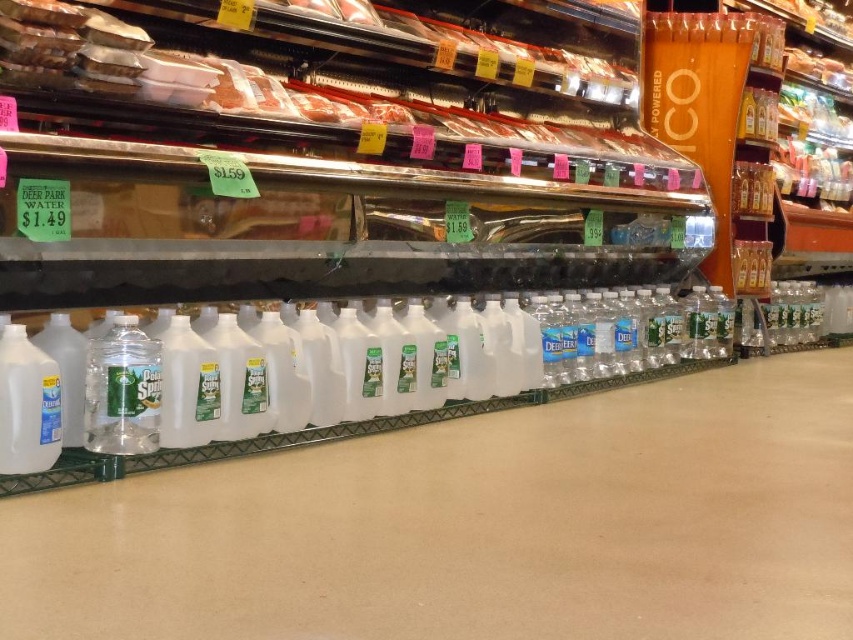
Question: Which point is closer to the camera taking this photo?

Choices:
 (A) (112, 353)
 (B) (55, 388)

Answer: (B)

Question: Can you confirm if clear plastic bottle at lower left is positioned above white plastic milk jug at lower left?

Choices:
 (A) yes
 (B) no

Answer: (A)

Question: Is clear plastic bottle at lower left wider than white plastic milk jug at lower left?

Choices:
 (A) no
 (B) yes

Answer: (B)

Question: Does clear plastic bottle at lower left appear under white plastic milk jug at lower left?

Choices:
 (A) no
 (B) yes

Answer: (A)

Question: Among these objects, which one is nearest to the camera?

Choices:
 (A) clear plastic bottle at lower left
 (B) white plastic milk jug at lower left

Answer: (B)